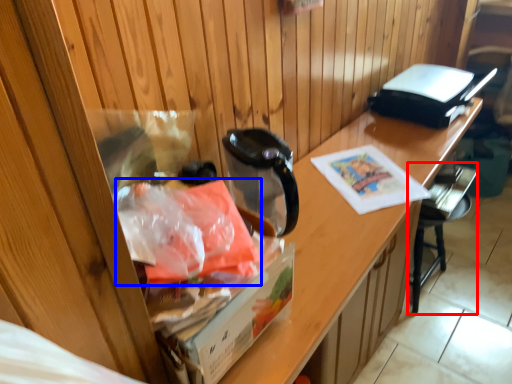
Question: Which object appears farthest to the camera in this image, chair (highlighted by a red box) or material (highlighted by a blue box)?

Choices:
 (A) chair
 (B) material

Answer: (A)